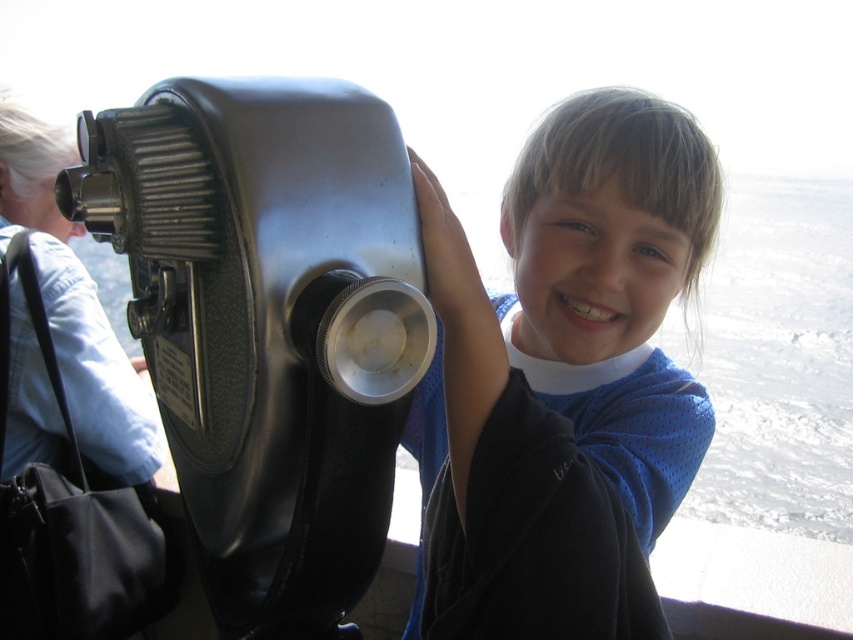
The user is trying to determine if the metallic gray telescope at left can fit inside a storage box designed for the blue mesh shirt at center. Based on the size comparison between the two objects, can the telescope fit inside the box?

The metallic gray telescope at left has a smaller size compared to blue mesh shirt at center, so it is likely that the telescope can fit inside the storage box designed for the shirt.